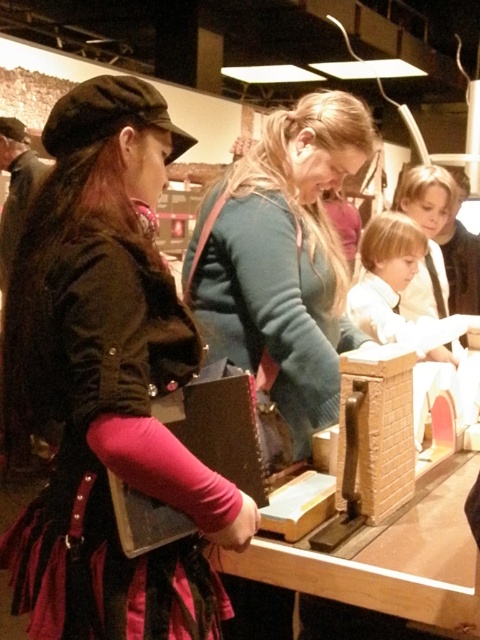
Is velvet black jacket at center wider than wooden table at center?

Incorrect, velvet black jacket at center's width does not surpass wooden table at center's.

How distant is velvet black jacket at center from wooden table at center?

They are 17.40 inches apart.

Who is more distant from viewer, (127, 362) or (384, 579)?

Point (384, 579)

Where is `velvet black jacket at center`? velvet black jacket at center is located at coordinates 107,384.

Is teal sweater at center above wooden table at center?

Correct, teal sweater at center is located above wooden table at center.

Who is positioned more to the left, teal sweater at center or wooden table at center?

teal sweater at center is more to the left.

The width and height of the screenshot is (480, 640). Identify the location of teal sweater at center. (284, 259).

This screenshot has height=640, width=480. Identify the location of velvet black jacket at center. (107, 384).

Which is behind, point (75, 532) or point (283, 620)?

The point (283, 620) is more distant.

This screenshot has height=640, width=480. Describe the element at coordinates (107, 384) in the screenshot. I see `velvet black jacket at center` at that location.

Identify the location of velvet black jacket at center. This screenshot has height=640, width=480. (107, 384).